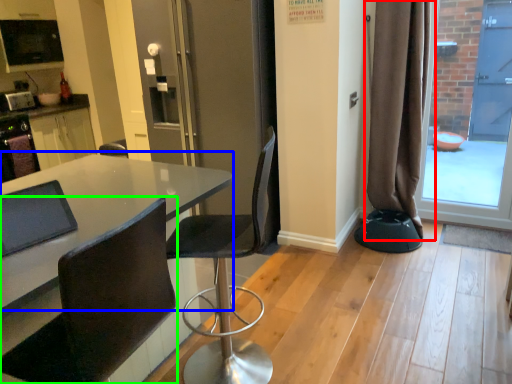
Question: Based on their relative distances, which object is nearer to curtain (highlighted by a red box)? Choose from table (highlighted by a blue box) and chair (highlighted by a green box).

Choices:
 (A) table
 (B) chair

Answer: (A)